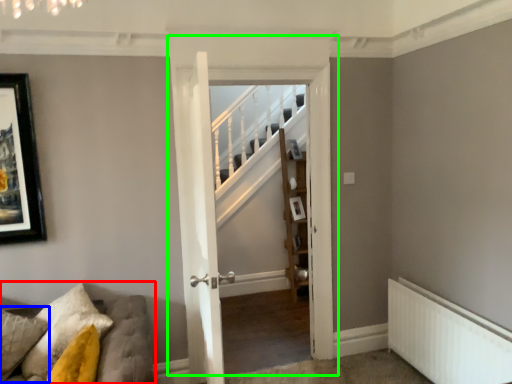
Question: Which is farther away from furniture (highlighted by a red box)? pillow (highlighted by a blue box) or door (highlighted by a green box)?

Choices:
 (A) pillow
 (B) door

Answer: (B)